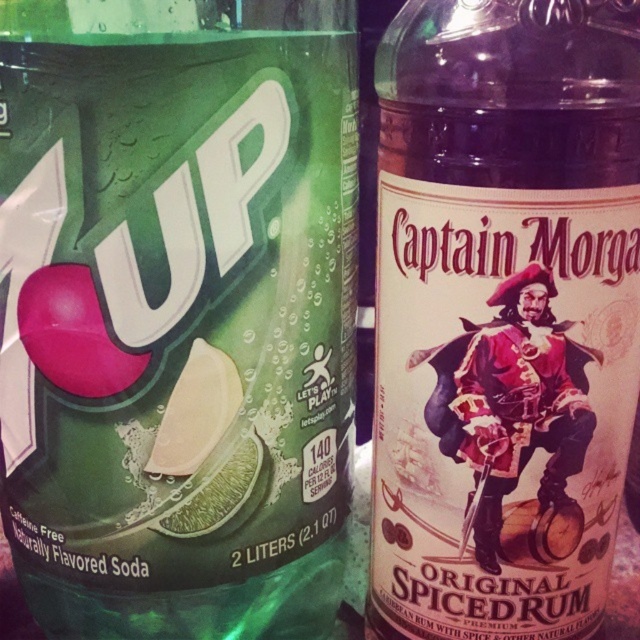
Which is behind, point (291, 305) or point (532, 310)?

Positioned behind is point (291, 305).

Is point (156, 451) behind point (396, 385)?

No, (156, 451) is in front of (396, 385).

Between point (118, 125) and point (544, 458), which one is positioned behind?

The point (544, 458) is more distant.

Where is `green matte soda bottle at center`? This screenshot has height=640, width=640. green matte soda bottle at center is located at coordinates (177, 314).

Can you confirm if translucent glass bottle at right is taller than green matte lime at center?

Indeed, translucent glass bottle at right has a greater height compared to green matte lime at center.

Does translucent glass bottle at right appear over green matte lime at center?

Yes.

Between point (589, 413) and point (211, 516), which one is positioned in front?

Point (589, 413) is in front.

The image size is (640, 640). I want to click on translucent glass bottle at right, so click(x=502, y=314).

Which of these two, green matte soda bottle at center or green matte lime at center, stands shorter?

green matte lime at center

Which is in front, point (337, 150) or point (221, 474)?

Point (337, 150) is more forward.

Between point (124, 364) and point (216, 513), which one is positioned behind?

The point (216, 513) is behind.

You are a GUI agent. You are given a task and a screenshot of the screen. Output one action in this format:
    pyautogui.click(x=<x>, y=<y>)
    Task: Click on the green matte soda bottle at center
    This screenshot has width=640, height=640.
    Given the screenshot: What is the action you would take?
    pyautogui.click(x=177, y=314)